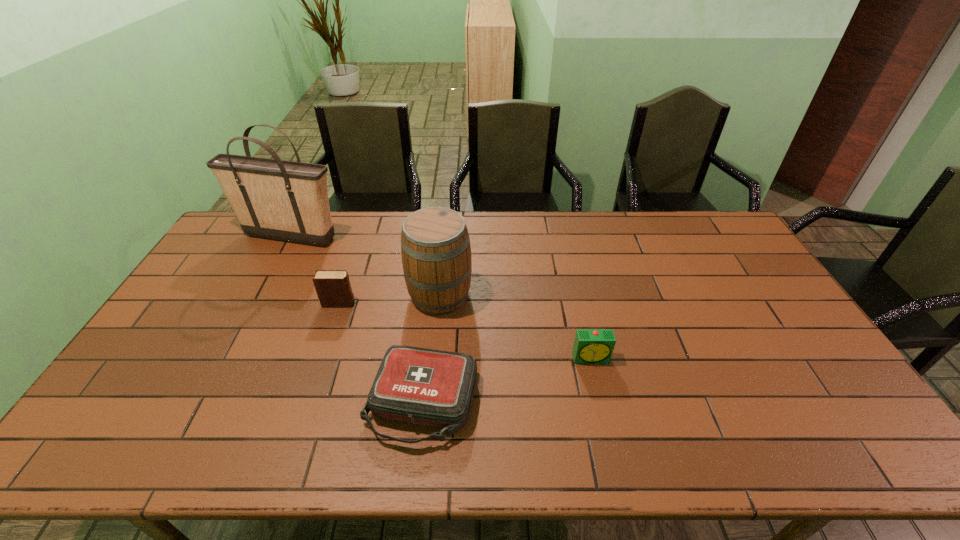
Locate which object is the fourth closest to the tallest object. Please provide its 2D coordinates. Your answer should be formatted as a tuple, i.e. [(x, y)], where the tuple contains the x and y coordinates of a point satisfying the conditions above.

[(591, 346)]

In order to click on the third closest object relative to the first-aid kit in this screenshot , I will do `click(591, 346)`.

Identify the location of vacant space that satisfies the following two spatial constraints: 1. on the spine side of the first-aid kit; 2. on the left side of the third tallest object. (306, 402).